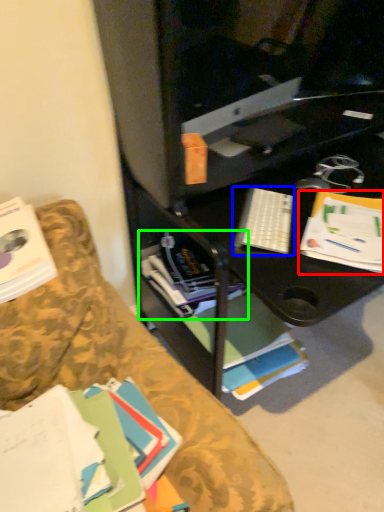
Question: Based on their relative distances, which object is nearer to paperback book (highlighted by a red box)? Choose from keyboard (highlighted by a blue box) and book (highlighted by a green box).

Choices:
 (A) keyboard
 (B) book

Answer: (A)